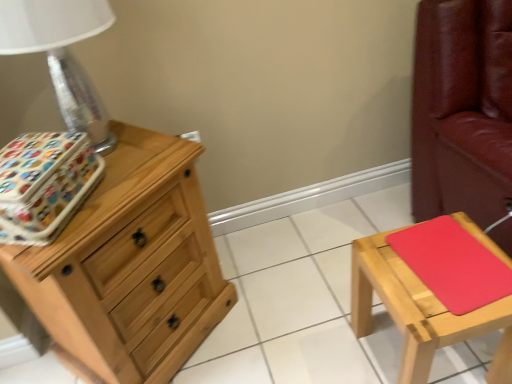
The height and width of the screenshot is (384, 512). Find the location of `natural wood chest of drawers at left`. natural wood chest of drawers at left is located at coordinates (131, 265).

The width and height of the screenshot is (512, 384). I want to click on matte wood stool at right, so click(420, 310).

Measure the distance between patterned fabric storage box at left and camera.

The distance of patterned fabric storage box at left from camera is 33.62 inches.

At what (x,y) coordinates should I click in order to perform the action: click on natural wood chest of drawers at left. Please return your answer as a coordinate pair (x, y). The height and width of the screenshot is (384, 512). Looking at the image, I should click on (131, 265).

Which object is further away from the camera taking this photo, metallic silver table lamp at left or matte wood stool at right?

matte wood stool at right is behind.

Is metallic silver table lamp at left at the right side of matte wood stool at right?

No, metallic silver table lamp at left is not to the right of matte wood stool at right.

Is metallic silver table lamp at left facing away from matte wood stool at right?

No.

Is metallic silver table lamp at left touching matte wood stool at right?

They are not placed beside each other.

From a real-world perspective, which is physically above, natural wood chest of drawers at left or red matte pad at right?

red matte pad at right, from a real-world perspective.

Does natural wood chest of drawers at left have a lesser height compared to red matte pad at right?

In fact, natural wood chest of drawers at left may be taller than red matte pad at right.

Considering the relative sizes of natural wood chest of drawers at left and red matte pad at right in the image provided, is natural wood chest of drawers at left bigger than red matte pad at right?

Correct, natural wood chest of drawers at left is larger in size than red matte pad at right.

Is natural wood chest of drawers at left facing away from red matte pad at right?

No, natural wood chest of drawers at left is not facing the opposite direction of red matte pad at right.

Is red matte pad at right far from matte wood stool at right?

No, there isn't a large distance between red matte pad at right and matte wood stool at right.

This screenshot has height=384, width=512. What are the coordinates of `stool below the red matte pad at right (from a real-world perspective)` in the screenshot? It's located at (420, 310).

Consider the image. Is red matte pad at right aimed at matte wood stool at right?

Yes.

Considering the points (403, 257) and (361, 279), which point is in front, point (403, 257) or point (361, 279)?

The point (403, 257) is more forward.

Is the position of natural wood chest of drawers at left less distant than that of matte wood stool at right?

Yes, natural wood chest of drawers at left is closer to the viewer.

Which object is wider, natural wood chest of drawers at left or matte wood stool at right?

natural wood chest of drawers at left is wider.

Who is bigger, natural wood chest of drawers at left or matte wood stool at right?

natural wood chest of drawers at left.

In the image, is natural wood chest of drawers at left on the left side or the right side of matte wood stool at right?

Clearly, natural wood chest of drawers at left is on the left of matte wood stool at right in the image.

Do you think matte wood stool at right is within natural wood chest of drawers at left, or outside of it?

matte wood stool at right is not enclosed by natural wood chest of drawers at left.

Is matte wood stool at right bigger than natural wood chest of drawers at left?

Actually, matte wood stool at right might be smaller than natural wood chest of drawers at left.

From a real-world perspective, which object rests below the other?

From a 3D spatial view, matte wood stool at right is below.

Which is more to the left, matte wood stool at right or natural wood chest of drawers at left?

natural wood chest of drawers at left.

Considering the sizes of natural wood chest of drawers at left and patterned fabric storage box at left in the image, is natural wood chest of drawers at left bigger or smaller than patterned fabric storage box at left?

Considering their sizes, natural wood chest of drawers at left takes up more space than patterned fabric storage box at left.

Is point (37, 268) farther from viewer compared to point (38, 144)?

No, (37, 268) is in front of (38, 144).

Looking at their sizes, would you say natural wood chest of drawers at left is wider or thinner than patterned fabric storage box at left?

Considering their sizes, natural wood chest of drawers at left looks broader than patterned fabric storage box at left.

Is natural wood chest of drawers at left positioned behind patterned fabric storage box at left?

Yes, the depth of natural wood chest of drawers at left is greater than that of patterned fabric storage box at left.

Is patterned fabric storage box at left in front of or behind metallic silver table lamp at left in the image?

In the image, patterned fabric storage box at left appears behind metallic silver table lamp at left.

Considering the relative sizes of patterned fabric storage box at left and metallic silver table lamp at left in the image provided, is patterned fabric storage box at left taller than metallic silver table lamp at left?

No.

Is patterned fabric storage box at left oriented away from metallic silver table lamp at left?

patterned fabric storage box at left is not turned away from metallic silver table lamp at left.

Does patterned fabric storage box at left have a larger size compared to metallic silver table lamp at left?

Incorrect, patterned fabric storage box at left is not larger than metallic silver table lamp at left.

The image size is (512, 384). Identify the location of table lamp on the left of matte wood stool at right. (x=61, y=54).

This screenshot has width=512, height=384. Identify the location of chest of drawers below the red matte pad at right (from a real-world perspective). (131, 265).

Looking at the image, which one is located further to matte wood stool at right, metallic silver table lamp at left or patterned fabric storage box at left?

metallic silver table lamp at left is positioned further to the anchor matte wood stool at right.

Which object lies nearer to the anchor point natural wood chest of drawers at left, patterned fabric storage box at left or metallic silver table lamp at left?

The object closer to natural wood chest of drawers at left is patterned fabric storage box at left.

Estimate the real-world distances between objects in this image. Which object is further from matte wood stool at right, red matte pad at right or natural wood chest of drawers at left?

natural wood chest of drawers at left is positioned further to the anchor matte wood stool at right.

When comparing their distances from red matte pad at right, does natural wood chest of drawers at left or patterned fabric storage box at left seem further?

patterned fabric storage box at left is further to red matte pad at right.

From the image, which object appears to be nearer to metallic silver table lamp at left, patterned fabric storage box at left or natural wood chest of drawers at left?

The object closer to metallic silver table lamp at left is patterned fabric storage box at left.

Looking at the image, which one is located closer to matte wood stool at right, patterned fabric storage box at left or metallic silver table lamp at left?

patterned fabric storage box at left is positioned closer to the anchor matte wood stool at right.

Consider the image. Estimate the real-world distances between objects in this image. Which object is further from matte wood stool at right, red matte pad at right or patterned fabric storage box at left?

The object further to matte wood stool at right is patterned fabric storage box at left.

Based on their spatial positions, is natural wood chest of drawers at left or matte wood stool at right further from patterned fabric storage box at left?

matte wood stool at right.

This screenshot has width=512, height=384. In order to click on stool situated between metallic silver table lamp at left and red matte pad at right from left to right in this screenshot , I will do `click(420, 310)`.

The height and width of the screenshot is (384, 512). Identify the location of chest of drawers between patterned fabric storage box at left and matte wood stool at right. (131, 265).

This screenshot has height=384, width=512. What are the coordinates of `table lamp between patterned fabric storage box at left and red matte pad at right` in the screenshot? It's located at (61, 54).

The image size is (512, 384). I want to click on the chest of drawers located between metallic silver table lamp at left and matte wood stool at right in the left-right direction, so click(131, 265).